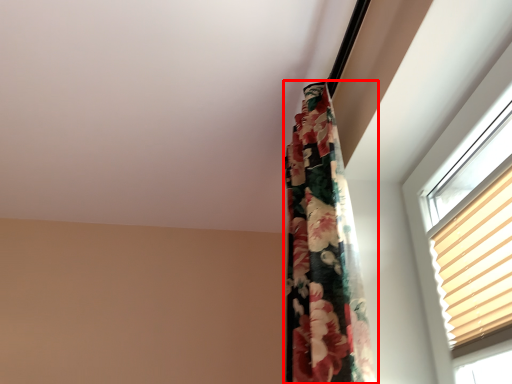
Question: In this image, where is curtain (annotated by the red box) located relative to blind?

Choices:
 (A) left
 (B) right

Answer: (A)